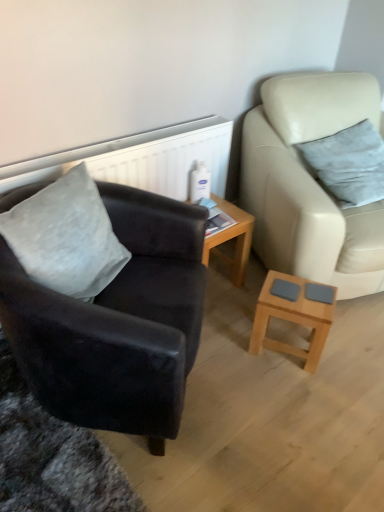
Question: Considering the relative sizes of leather studio couch at right and gray velvety pillow at left, arranged as the 1th pillow when viewed from the front, in the image provided, is leather studio couch at right wider than gray velvety pillow at left, arranged as the 1th pillow when viewed from the front,?

Choices:
 (A) no
 (B) yes

Answer: (B)

Question: Is leather studio couch at right further to the viewer compared to gray velvety pillow at left, arranged as the 2th pillow when viewed from the right?

Choices:
 (A) no
 (B) yes

Answer: (B)

Question: Are leather studio couch at right and gray velvety pillow at left, the second pillow when ordered from back to front, making contact?

Choices:
 (A) no
 (B) yes

Answer: (A)

Question: Does leather studio couch at right contain gray velvety pillow at left, arranged as the 1th pillow when viewed from the front?

Choices:
 (A) no
 (B) yes

Answer: (A)

Question: Is leather studio couch at right oriented towards gray velvety pillow at left, the second pillow when ordered from back to front?

Choices:
 (A) no
 (B) yes

Answer: (A)

Question: From a real-world perspective, is leather studio couch at right located higher than gray velvety pillow at left, the second pillow when ordered from back to front?

Choices:
 (A) no
 (B) yes

Answer: (A)

Question: Does gray velvety pillow at left, the second pillow when ordered from back to front, have a smaller size compared to suede black armchair at left?

Choices:
 (A) no
 (B) yes

Answer: (B)

Question: Considering the relative sizes of gray velvety pillow at left, arranged as the 2th pillow when viewed from the right, and suede black armchair at left in the image provided, is gray velvety pillow at left, arranged as the 2th pillow when viewed from the right, thinner than suede black armchair at left?

Choices:
 (A) no
 (B) yes

Answer: (B)

Question: Is suede black armchair at left a part of gray velvety pillow at left, the second pillow when ordered from back to front?

Choices:
 (A) yes
 (B) no

Answer: (B)

Question: Is gray velvety pillow at left, arranged as the 1th pillow when viewed from the front, facing away from suede black armchair at left?

Choices:
 (A) yes
 (B) no

Answer: (A)

Question: From a real-world perspective, is gray velvety pillow at left, arranged as the 1th pillow when viewed from the front, over suede black armchair at left?

Choices:
 (A) no
 (B) yes

Answer: (B)

Question: Is gray velvety pillow at left, the first pillow viewed from the left, not close to suede black armchair at left?

Choices:
 (A) yes
 (B) no

Answer: (B)

Question: Considering the relative positions of leather studio couch at right and light brown wooden coffee table at lower right in the image provided, is leather studio couch at right to the left of light brown wooden coffee table at lower right from the viewer's perspective?

Choices:
 (A) yes
 (B) no

Answer: (B)